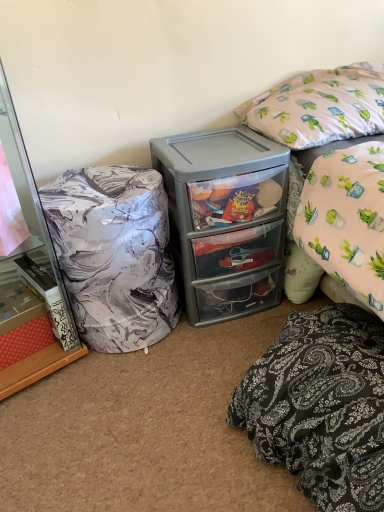
Question: From the image's perspective, is black paisley pillow at lower right, the 2th pillow when ordered from top to bottom, above or below pink fabric pillow at upper right, acting as the 1th pillow starting from the top?

Choices:
 (A) above
 (B) below

Answer: (B)

Question: From a real-world perspective, is black paisley pillow at lower right, the 2th pillow when ordered from top to bottom, above or below pink fabric pillow at upper right, the second pillow in the bottom-to-top sequence?

Choices:
 (A) above
 (B) below

Answer: (B)

Question: Which object is the farthest from the black paisley pillow at lower right, the 2th pillow when ordered from top to bottom?

Choices:
 (A) pink fabric pillow at upper right, the second pillow in the bottom-to-top sequence
 (B) gray plastic storage at center
 (C) marble-patterned fabric at left
 (D) marble-patterned bean bag at left

Answer: (C)

Question: Considering the real-world distances, which object is closest to the marble-patterned fabric at left?

Choices:
 (A) marble-patterned bean bag at left
 (B) black paisley pillow at lower right, the 2th pillow when ordered from top to bottom
 (C) gray plastic storage at center
 (D) pink fabric pillow at upper right, the second pillow in the bottom-to-top sequence

Answer: (A)